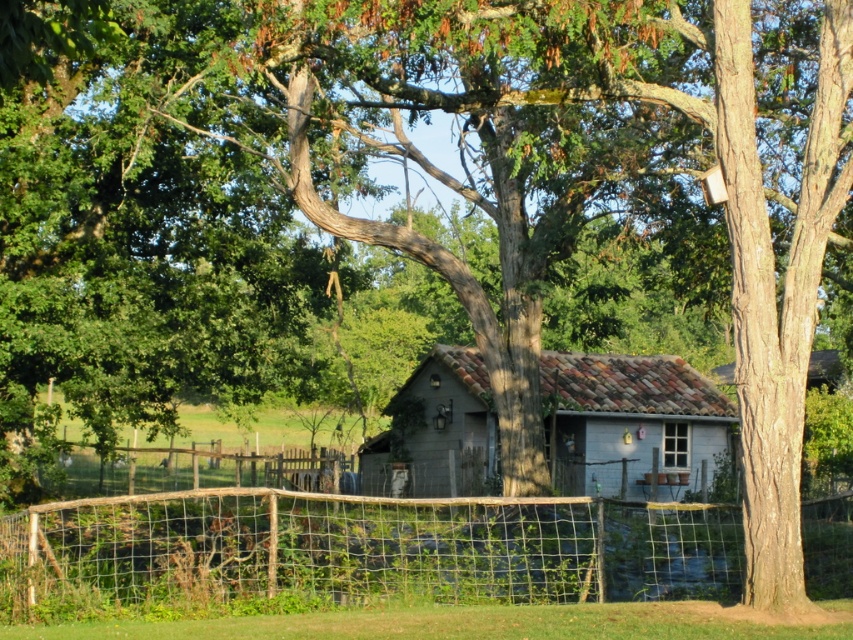
Question: Where is rustic wire mesh fence at lower center located in relation to gray wood cabin at center in the image?

Choices:
 (A) left
 (B) right

Answer: (B)

Question: Does rustic wire mesh fence at lower center appear on the right side of gray wood cabin at center?

Choices:
 (A) no
 (B) yes

Answer: (B)

Question: Among these objects, which one is farthest from the camera?

Choices:
 (A) gray wood cabin at center
 (B) rustic wire mesh fence at lower center

Answer: (A)

Question: Which object is farther from the camera taking this photo?

Choices:
 (A) rustic wire mesh fence at lower center
 (B) gray wood cabin at center

Answer: (B)

Question: Is rustic wire mesh fence at lower center to the left of gray wood cabin at center from the viewer's perspective?

Choices:
 (A) no
 (B) yes

Answer: (A)